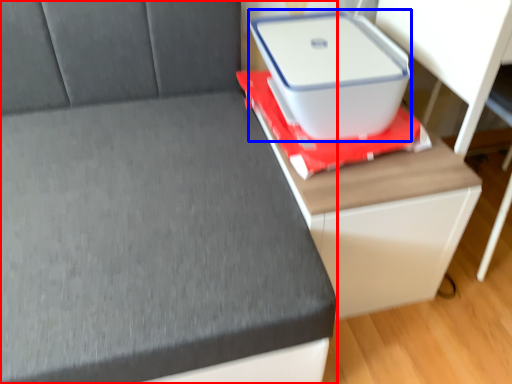
Question: Which object appears farthest to the camera in this image, furniture (highlighted by a red box) or storage box (highlighted by a blue box)?

Choices:
 (A) furniture
 (B) storage box

Answer: (B)